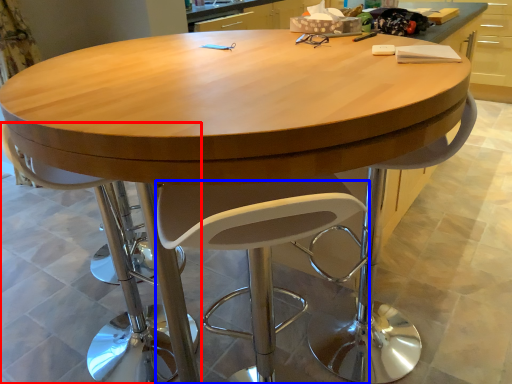
Question: Which object is further to the camera taking this photo, chair (highlighted by a red box) or swivel chair (highlighted by a blue box)?

Choices:
 (A) chair
 (B) swivel chair

Answer: (A)